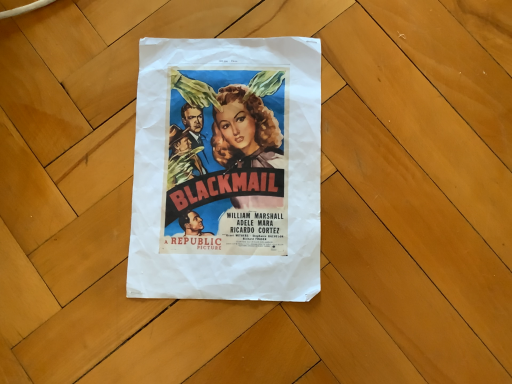
Image resolution: width=512 pixels, height=384 pixels. Find the location of `matte paper poster at center`. matte paper poster at center is located at coordinates (227, 170).

Describe the element at coordinates (227, 170) in the screenshot. The height and width of the screenshot is (384, 512). I see `matte paper poster at center` at that location.

Where is `matte paper poster at center`? This screenshot has height=384, width=512. matte paper poster at center is located at coordinates (227, 170).